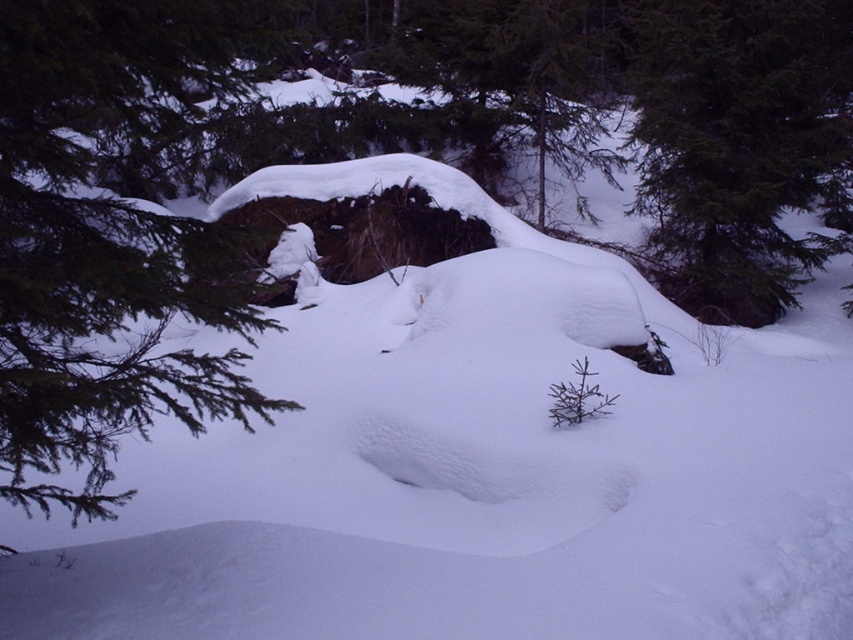
You are an observer standing in the winter scene. You notice the green textured pine branch at left and the green textured tree at upper right. Which one is taller?

The green textured tree at upper right is taller than the green textured pine branch at left.

You are an observer standing in the winter scene. You notice the green textured pine branch at left and the green textured tree at upper right. Which object is closer to you?

The green textured pine branch at left is closer to you because it is positioned under the green textured tree at upper right, indicating it is in a lower plane.

You are standing at point [107,243] in the winter scene. What object is located exactly at your position?

At point [107,243] lies green textured pine branch at left.